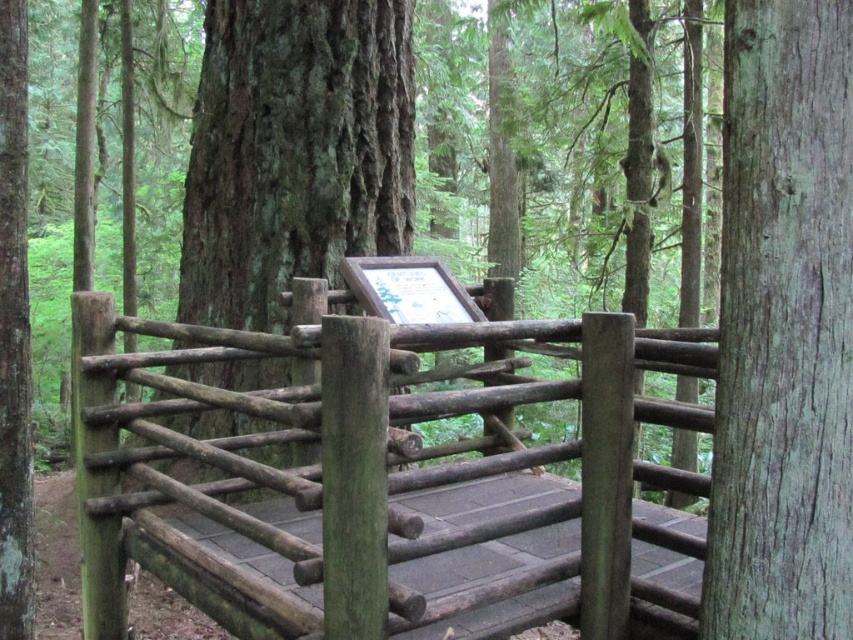
You are a park ranger assessing the structural integrity of the green wood fence at center and the gray rough wood at right. Which structure has a greater width according to the scene?

The green wood fence at center has a greater width than the gray rough wood at right.

You are a hiker who wants to take a photo of the green rough bark tree at center without the green wood fence at center blocking the view. Is there a way to do this by moving forward or backward?

The green wood fence at center is in front of the green rough bark tree at center, so if you move backward, the fence may appear smaller relative to the tree, potentially allowing you to frame the tree without the fence blocking it. Alternatively, moving to the side could also help, but since the question specifies moving forward or backward, adjusting your distance from the scene would be the best option.